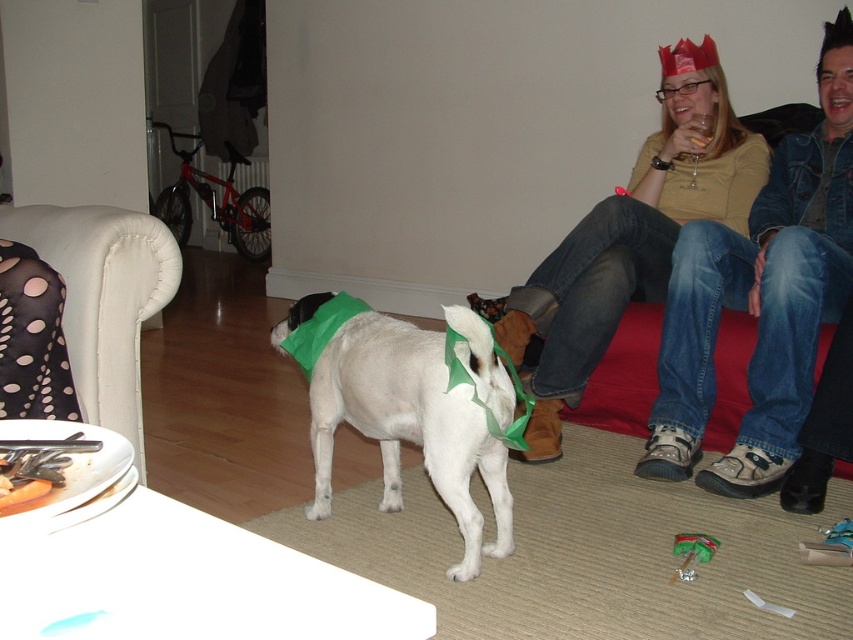
Between white fabric dog at center and white fabric armchair at left, which one appears on the right side from the viewer's perspective?

From the viewer's perspective, white fabric dog at center appears more on the right side.

Is point (355, 339) positioned before point (107, 243)?

No, it is not.

Measure the distance between point (335, 364) and camera.

Point (335, 364) and camera are 6.25 feet apart.

Where is `white fabric dog at center`? white fabric dog at center is located at coordinates (408, 424).

Does matte yellow shirt at upper right have a lesser height compared to white fabric armchair at left?

Incorrect, matte yellow shirt at upper right's height does not fall short of white fabric armchair at left's.

Consider the image. Can you confirm if matte yellow shirt at upper right is smaller than white fabric armchair at left?

No, matte yellow shirt at upper right is not smaller than white fabric armchair at left.

Is point (517, 365) more distant than point (129, 221)?

Yes.

The width and height of the screenshot is (853, 640). In order to click on matte yellow shirt at upper right in this screenshot , I will do `click(631, 236)`.

Is point (703, 253) farther from viewer compared to point (523, 332)?

No, (703, 253) is closer to viewer.

What do you see at coordinates (761, 298) in the screenshot? The image size is (853, 640). I see `denim jacket at upper right` at bounding box center [761, 298].

The height and width of the screenshot is (640, 853). Identify the location of denim jacket at upper right. (761, 298).